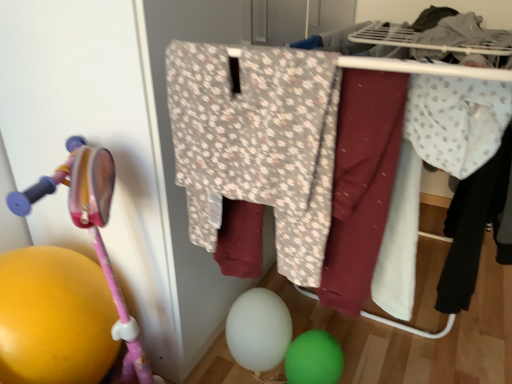
Question: Is white matte balloon at lower center, the 1th balloon from the left, inside the boundaries of floral fabric pants at center, or outside?

Choices:
 (A) inside
 (B) outside

Answer: (B)

Question: Is white matte balloon at lower center, the 1th balloon from the left, wider or thinner than floral fabric pants at center?

Choices:
 (A) thin
 (B) wide

Answer: (A)

Question: Based on their relative distances, which object is nearer to the green rubber balloon at lower center, which ranks as the second balloon in left-to-right order?

Choices:
 (A) white dotted fabric at right, the 2th clothing viewed from the back
 (B) floral fabric pants at center
 (C) white matte balloon at lower center, the 1th balloon from the left
 (D) light blue dotted fabric at right, the 3th clothing positioned from the left
 (E) pink plastic baby carriage at left

Answer: (C)

Question: Based on their relative distances, which object is nearer to the white dotted fabric at right, which is the 2th clothing from front to back?

Choices:
 (A) floral-patterned fabric at center, positioned as the first clothing in front-to-back order
 (B) light blue dotted fabric at right, which is the first clothing from right to left
 (C) green rubber balloon at lower center, arranged as the first balloon when viewed from the right
 (D) pink plastic baby carriage at left
 (E) floral fabric pants at center

Answer: (E)